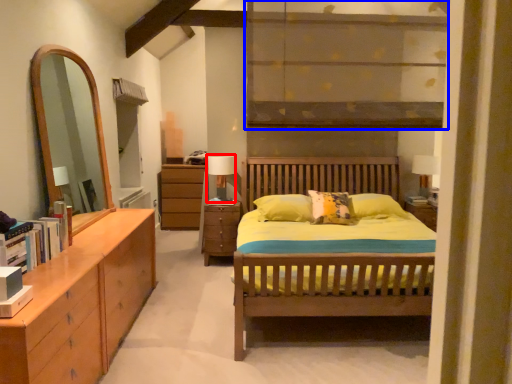
Question: Which point is closer to the camera, table lamp (highlighted by a red box) or shelf (highlighted by a blue box)?

Choices:
 (A) table lamp
 (B) shelf

Answer: (B)